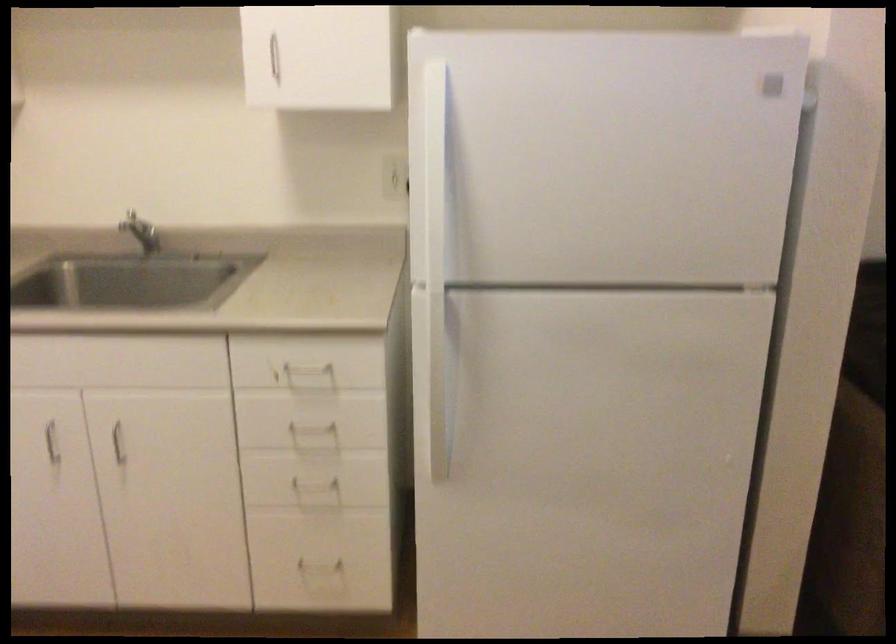
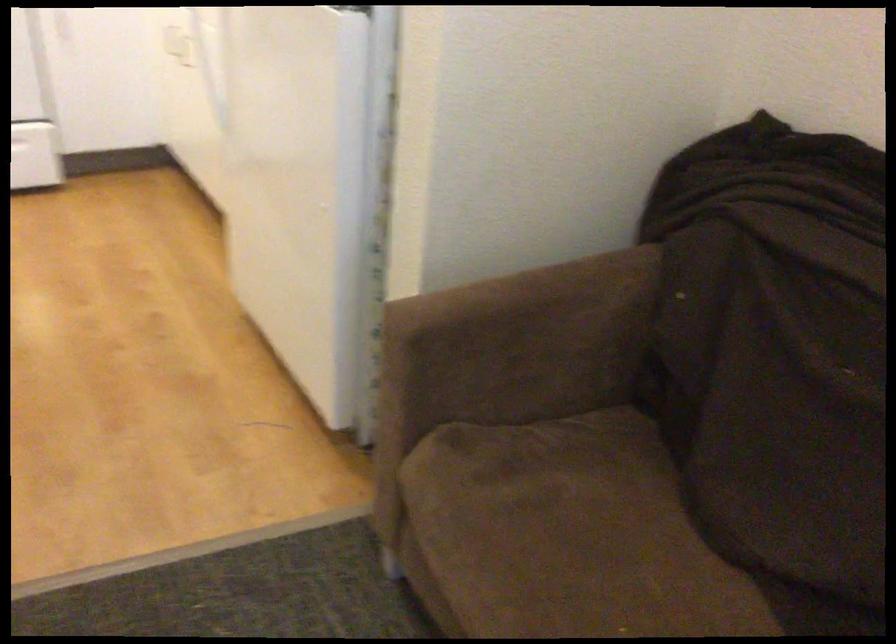
Question: I am providing you with two images of the same scene from different viewpoints. Which of the following objects are not visible in image2?

Choices:
 (A) sofa sitting surface
 (B) brown sofa armrest
 (C) red board eraser
 (D) white drawer handle

Answer: (D)